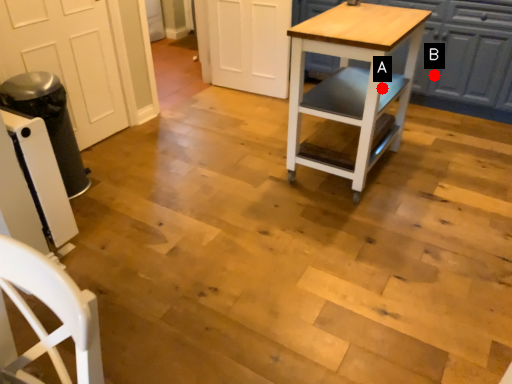
Question: Two points are circled on the image, labeled by A and B beside each circle. Which point is further to the camera?

Choices:
 (A) A is further
 (B) B is further

Answer: (B)